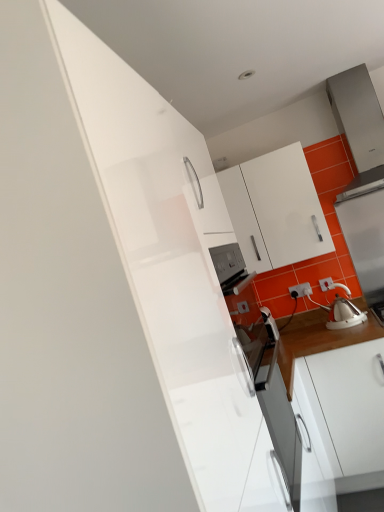
Question: Is white glossy kettle at right positioned behind white glossy tea pot at right?

Choices:
 (A) no
 (B) yes

Answer: (B)

Question: From the image's perspective, does white glossy kettle at right appear lower than white glossy tea pot at right?

Choices:
 (A) no
 (B) yes

Answer: (A)

Question: Could you tell me if white glossy kettle at right is turned towards white glossy tea pot at right?

Choices:
 (A) yes
 (B) no

Answer: (B)

Question: Is white glossy kettle at right closer to the viewer compared to white glossy tea pot at right?

Choices:
 (A) yes
 (B) no

Answer: (B)

Question: Considering the relative sizes of white glossy kettle at right and white glossy tea pot at right in the image provided, is white glossy kettle at right shorter than white glossy tea pot at right?

Choices:
 (A) no
 (B) yes

Answer: (A)

Question: Is white plastic electric outlet at lower right situated inside white glossy cabinet at upper center or outside?

Choices:
 (A) inside
 (B) outside

Answer: (B)

Question: Considering the relative positions of white plastic electric outlet at lower right and white glossy cabinet at upper center in the image provided, is white plastic electric outlet at lower right to the left or to the right of white glossy cabinet at upper center?

Choices:
 (A) right
 (B) left

Answer: (A)

Question: Is point (296, 288) closer or farther from the camera than point (278, 162)?

Choices:
 (A) farther
 (B) closer

Answer: (A)

Question: Looking at their shapes, would you say white plastic electric outlet at lower right is wider or thinner than white glossy cabinet at upper center?

Choices:
 (A) wide
 (B) thin

Answer: (B)

Question: Is white glossy cabinet at upper center to the left or to the right of white plastic electric outlet at lower right in the image?

Choices:
 (A) left
 (B) right

Answer: (A)

Question: From a real-world perspective, is white glossy cabinet at upper center above or below white plastic electric outlet at lower right?

Choices:
 (A) below
 (B) above

Answer: (B)

Question: Is white glossy cabinet at upper center in front of or behind white plastic electric outlet at lower right in the image?

Choices:
 (A) front
 (B) behind

Answer: (A)

Question: Is white glossy cabinet at upper center situated inside white plastic electric outlet at lower right or outside?

Choices:
 (A) inside
 (B) outside

Answer: (B)

Question: Considering the relative positions of white glossy cabinet at upper center and white glossy kettle at right in the image provided, is white glossy cabinet at upper center to the left or to the right of white glossy kettle at right?

Choices:
 (A) left
 (B) right

Answer: (A)

Question: From the image's perspective, relative to white glossy kettle at right, is white glossy cabinet at upper center above or below?

Choices:
 (A) above
 (B) below

Answer: (A)